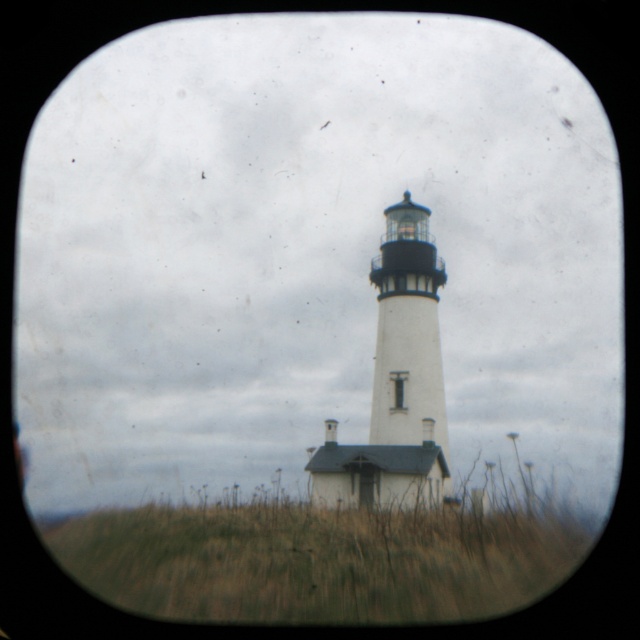
Does white matte/lightweight tower at center have a greater height compared to transparent glass window at center?

Yes, white matte/lightweight tower at center is taller than transparent glass window at center.

Is point (420, 372) closer to viewer compared to point (400, 380)?

Yes.

Which is in front, point (388, 278) or point (396, 378)?

Point (396, 378)

Where is `white matte/lightweight tower at center`? The image size is (640, 640). white matte/lightweight tower at center is located at coordinates (406, 330).

Who is lower down, brown dry grass at lower center or transparent glass window at center?

Positioned lower is brown dry grass at lower center.

What do you see at coordinates (321, 557) in the screenshot? I see `brown dry grass at lower center` at bounding box center [321, 557].

Find the location of a particular element. The height and width of the screenshot is (640, 640). brown dry grass at lower center is located at coordinates (321, 557).

Is brown dry grass at lower center closer to camera compared to white matte/lightweight tower at center?

That is False.

Can you confirm if brown dry grass at lower center is positioned above white matte/lightweight tower at center?

No, brown dry grass at lower center is not above white matte/lightweight tower at center.

Which is behind, point (339, 582) or point (388, 396)?

The point (388, 396) is more distant.

Where is `brown dry grass at lower center`? brown dry grass at lower center is located at coordinates (321, 557).